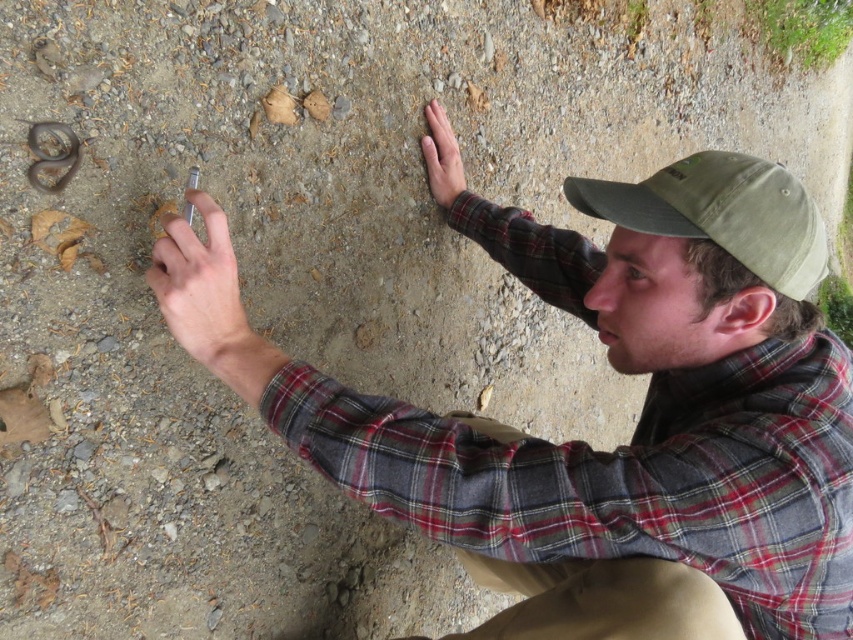
Is point (772, 264) in front of point (450, 148)?

Yes, it is.

Can you confirm if green fabric baseball cap at upper right is shorter than matte brown hand at upper right?

Correct, green fabric baseball cap at upper right is not as tall as matte brown hand at upper right.

Measure the distance between point (769, 202) and camera.

Point (769, 202) is 35.01 inches away from camera.

The image size is (853, 640). I want to click on green fabric baseball cap at upper right, so click(x=721, y=212).

Is green fabric baseball cap at upper right closer to camera compared to pale skin at center?

Yes.

Does green fabric baseball cap at upper right appear on the right side of pale skin at center?

Indeed, green fabric baseball cap at upper right is positioned on the right side of pale skin at center.

Which is in front, point (737, 177) or point (222, 310)?

Point (737, 177) is in front.

At what (x,y) coordinates should I click in order to perform the action: click on green fabric baseball cap at upper right. Please return your answer as a coordinate pair (x, y). Looking at the image, I should click on (721, 212).

Between khaki pants at lower center and pale skin at center, which one appears on the right side from the viewer's perspective?

khaki pants at lower center is more to the right.

How much distance is there between khaki pants at lower center and pale skin at center?

khaki pants at lower center and pale skin at center are 20.16 inches apart.

Who is more distant from viewer, (x=473, y=428) or (x=201, y=268)?

Point (x=473, y=428)

At what (x,y) coordinates should I click in order to perform the action: click on khaki pants at lower center. Please return your answer as a coordinate pair (x, y). Looking at the image, I should click on (601, 600).